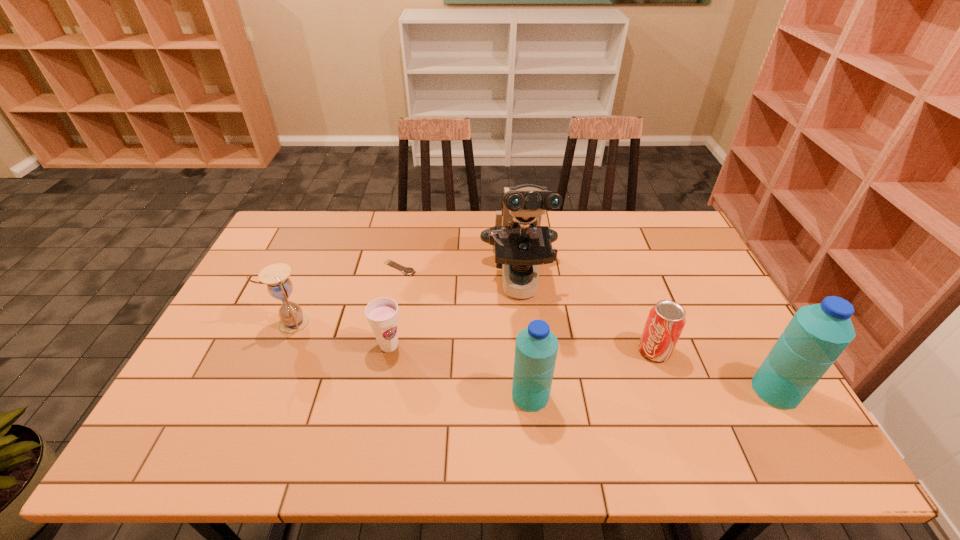
At what (x,y) coordinates should I click in order to perform the action: click on vacant space that is in between the watch and the sixth shortest object. Please return your answer as a coordinate pair (x, y). Looking at the image, I should click on (588, 329).

Identify the location of free space between the fourth tallest object and the cup. (341, 335).

Find the location of a particular element. The width and height of the screenshot is (960, 540). empty space between the shortest object and the taller water bottle is located at coordinates (588, 329).

Where is `unoccupied position between the cup and the hourglass`? unoccupied position between the cup and the hourglass is located at coordinates (341, 335).

Locate an element on the screen. vacant space in between the leftmost object and the left water bottle is located at coordinates (412, 360).

In order to click on free spot between the soda can and the rightmost object in this screenshot , I will do click(715, 370).

Identify the location of object that stands as the third closest to the fourth tallest object. (520, 242).

Identify the location of object that is the closest one to the cup. (293, 320).

Find the location of a particular element. free location that satisfies the following two spatial constraints: 1. on the front side of the rightmost object; 2. on the right side of the cup is located at coordinates (380, 390).

Where is `vacant space that satisfies the following two spatial constraints: 1. through the eyepieces of the right water bottle; 2. on the left side of the microscope`? The image size is (960, 540). vacant space that satisfies the following two spatial constraints: 1. through the eyepieces of the right water bottle; 2. on the left side of the microscope is located at coordinates (530, 390).